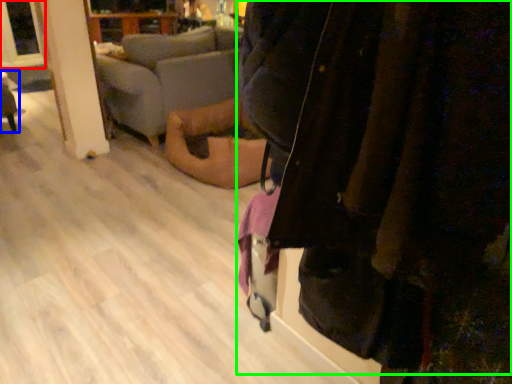
Question: Considering the real-world distances, which object is closest to window screen (highlighted by a red box)? furniture (highlighted by a blue box) or jacket (highlighted by a green box).

Choices:
 (A) furniture
 (B) jacket

Answer: (A)